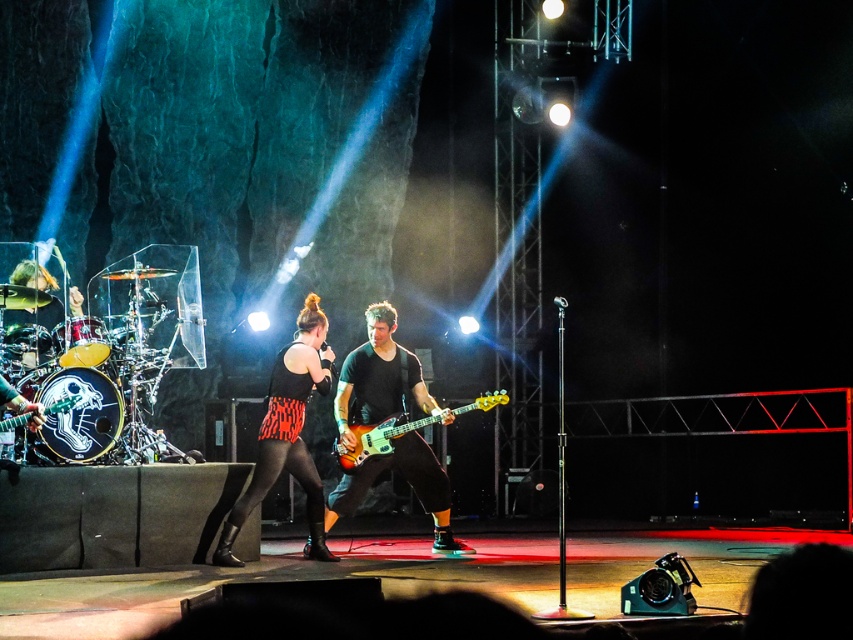
Is zebra print dress at center positioned at the back of shiny orange wood bass guitar at center?

No.

What do you see at coordinates (288, 433) in the screenshot? I see `zebra print dress at center` at bounding box center [288, 433].

Where is `zebra print dress at center`? zebra print dress at center is located at coordinates (288, 433).

Who is more forward, (381, 401) or (219, 561)?

Positioned in front is point (219, 561).

Who is lower down, shiny orange bass guitar at center or zebra print dress at center?

shiny orange bass guitar at center is below.

Who is more distant from viewer, (374, 397) or (233, 513)?

Point (374, 397)

Find the location of a particular element. Image resolution: width=853 pixels, height=640 pixels. shiny orange bass guitar at center is located at coordinates (379, 378).

Can you confirm if shiny orange bass guitar at center is shorter than shiny metallic guitar at left?

No.

I want to click on shiny orange bass guitar at center, so click(x=379, y=378).

Locate an element on the screen. shiny orange bass guitar at center is located at coordinates point(379,378).